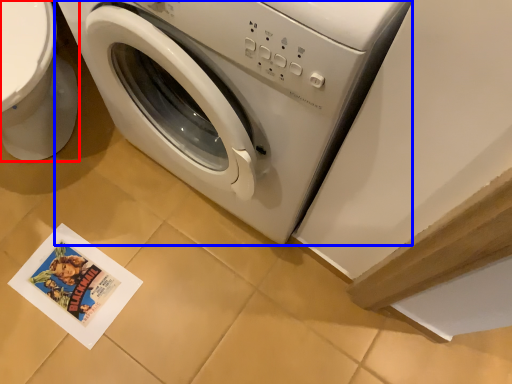
Question: Which of the following is the closest to the observer, toilet bowl (highlighted by a red box) or washing machine (highlighted by a blue box)?

Choices:
 (A) toilet bowl
 (B) washing machine

Answer: (B)